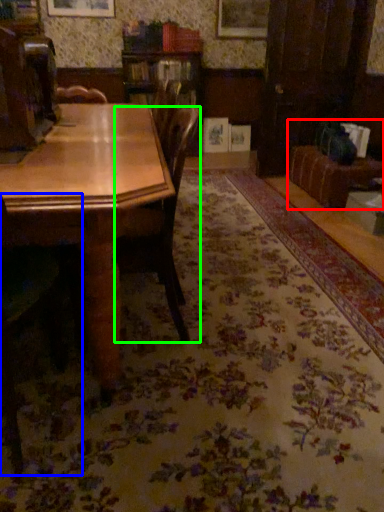
Question: Which object is the closest to the couch (highlighted by a red box)? Choose among these: chair (highlighted by a blue box) or chair (highlighted by a green box).

Choices:
 (A) chair
 (B) chair

Answer: (B)